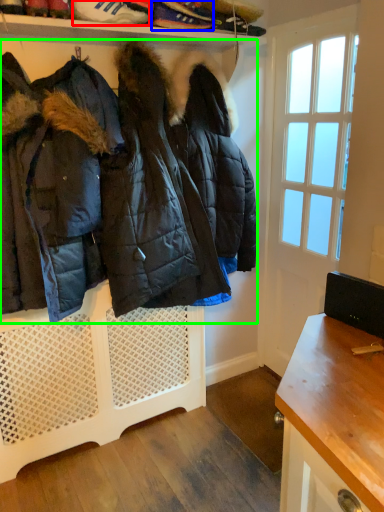
Question: Which object is the closest to the footwear (highlighted by a red box)? Choose among these: footwear (highlighted by a blue box) or jacket (highlighted by a green box).

Choices:
 (A) footwear
 (B) jacket

Answer: (A)